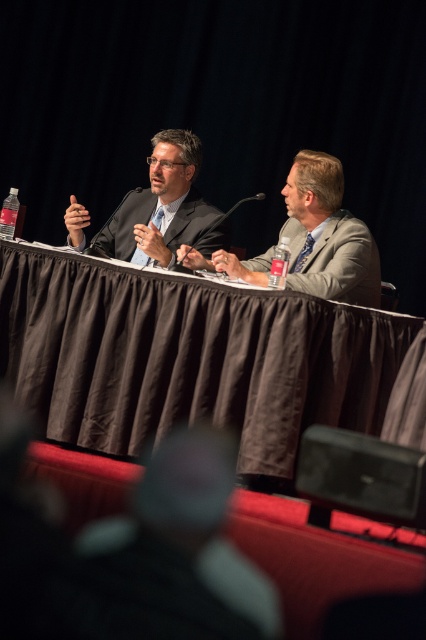
You are a photographer standing behind the man on the left. You want to place two markers on the table at the coordinates point [173,227] and point [138,189]. Which marker is closer to the photographer?

Point [173,227] is in front of point [138,189], so the marker at point [173,227] is closer to the photographer.

You are an event organizer who needs to adjust the seating arrangement. You want to move the matte black suit at center to the left side of the table. However, there is already a microphone there. Can you move the matte black microphone at center to the right to make space?

The matte black suit at center is located above the matte black microphone at center. Since the microphone is directly under the suit, moving the microphone to the right would create space for the suit to be moved to the left side of the table.

You are organizing a conference and need to ensure that the matte black suit at center and the black plastic microphone at center are both placed on a table. Given that the table has limited space, which object should you prioritize placing first to accommodate both items?

The matte black suit at center has a larger size compared to the black plastic microphone at center, so you should prioritize placing the matte black suit at center first to ensure there is enough space for both items.